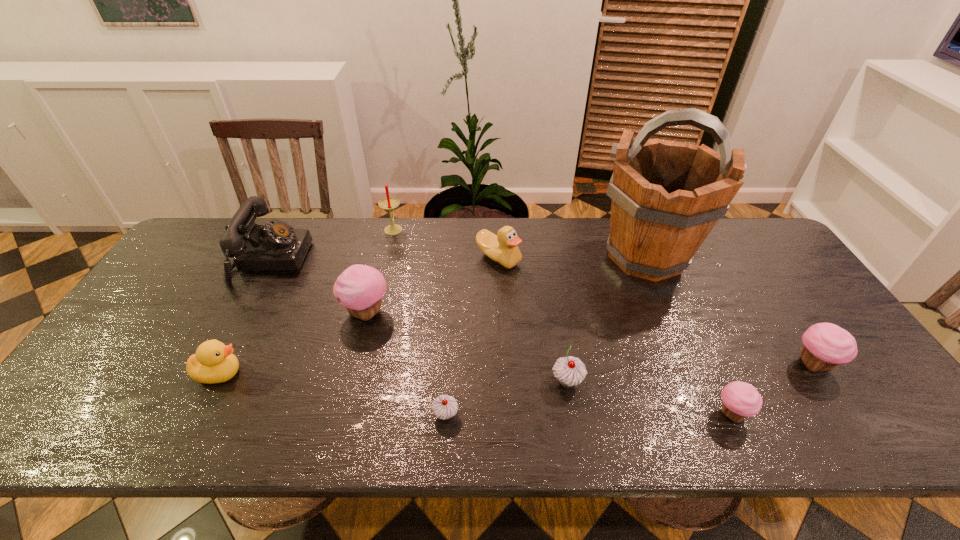
At what (x,y) coordinates should I click in order to perform the action: click on object at the right edge. Please return your answer as a coordinate pair (x, y). The width and height of the screenshot is (960, 540). Looking at the image, I should click on (825, 345).

Where is `vacant space at the far edge of the desktop`? Image resolution: width=960 pixels, height=540 pixels. vacant space at the far edge of the desktop is located at coordinates (582, 227).

This screenshot has width=960, height=540. In the image, there is a desktop. Find the location of `free space at the near edge`. free space at the near edge is located at coordinates (798, 436).

The height and width of the screenshot is (540, 960). Identify the location of free space at the left edge of the desktop. (129, 395).

This screenshot has width=960, height=540. In order to click on free space between the fourth cupcake from left to right and the black telephone in this screenshot , I will do `click(501, 336)`.

The height and width of the screenshot is (540, 960). In order to click on empty space that is in between the black telephone and the farther gray cupcake in this screenshot , I will do `click(419, 321)`.

At what (x,y) coordinates should I click in order to perform the action: click on unoccupied area between the smallest pink cupcake and the beige duck. Please return your answer as a coordinate pair (x, y). Looking at the image, I should click on click(615, 336).

Where is `free space that is in between the third cupcake from right to left and the black telephone`? The height and width of the screenshot is (540, 960). free space that is in between the third cupcake from right to left and the black telephone is located at coordinates (419, 321).

The width and height of the screenshot is (960, 540). I want to click on unoccupied position between the second smallest pink cupcake and the bigger gray cupcake, so click(690, 373).

Where is `empty space between the fifth object from right to left and the right gray cupcake`? This screenshot has height=540, width=960. empty space between the fifth object from right to left and the right gray cupcake is located at coordinates (533, 320).